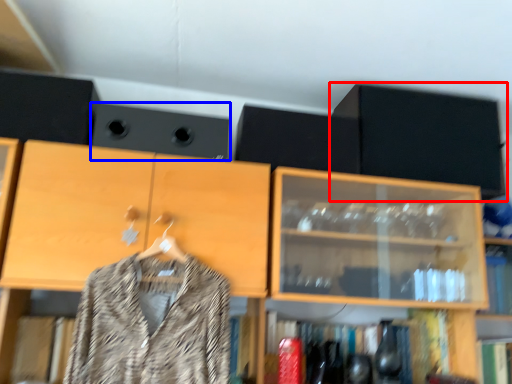
Question: Which object is closer to the camera taking this photo, cabinetry (highlighted by a red box) or speaker (highlighted by a blue box)?

Choices:
 (A) cabinetry
 (B) speaker

Answer: (B)